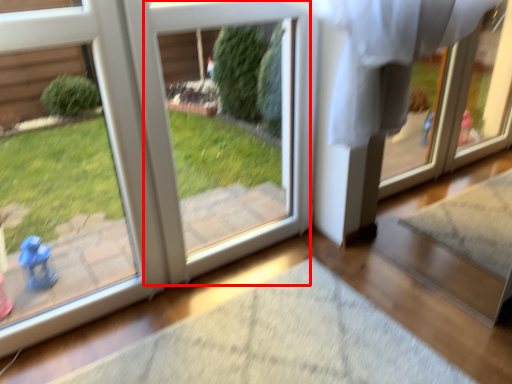
Question: From the image, what is the correct spatial relationship of screen door (annotated by the red box) in relation to door?

Choices:
 (A) right
 (B) left

Answer: (A)